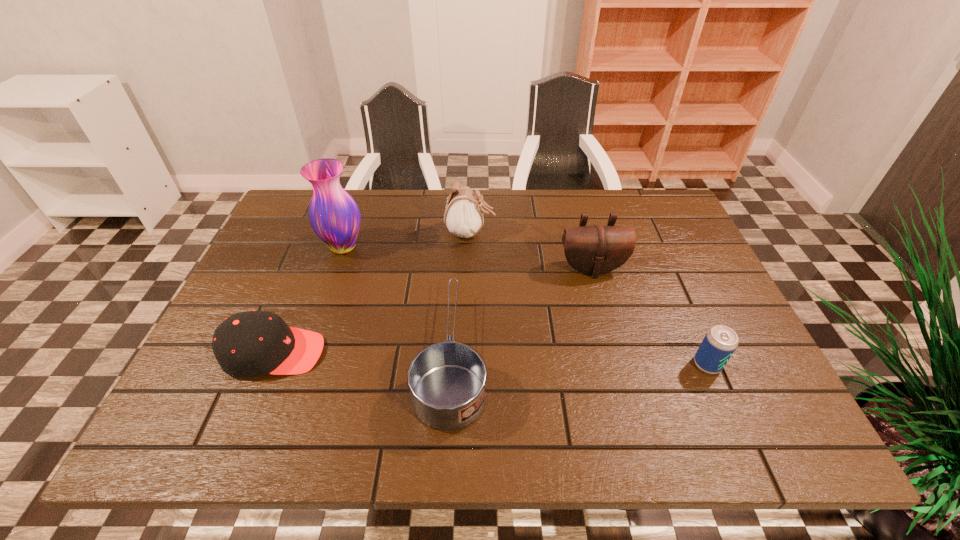
Find the location of `free spot that satisfies the following two spatial constraints: 1. with the handle extending from one side of the saucepan; 2. on the front-facing side of the cap`. free spot that satisfies the following two spatial constraints: 1. with the handle extending from one side of the saucepan; 2. on the front-facing side of the cap is located at coordinates (452, 353).

Locate an element on the screen. The image size is (960, 540). free space that satisfies the following two spatial constraints: 1. with the flap open on the right pouch; 2. on the front-facing side of the cap is located at coordinates (614, 353).

You are a GUI agent. You are given a task and a screenshot of the screen. Output one action in this format:
    pyautogui.click(x=<x>, y=<y>)
    Task: Click on the free location that satisfies the following two spatial constraints: 1. with the handle extending from one side of the saucepan; 2. on the front-facing side of the cap
    The image size is (960, 540).
    Given the screenshot: What is the action you would take?
    pyautogui.click(x=452, y=353)

You are a GUI agent. You are given a task and a screenshot of the screen. Output one action in this format:
    pyautogui.click(x=<x>, y=<y>)
    Task: Click on the free space that satisfies the following two spatial constraints: 1. on the front-facing side of the cap; 2. on the right side of the rightmost object
    The height and width of the screenshot is (540, 960).
    Given the screenshot: What is the action you would take?
    pyautogui.click(x=269, y=364)